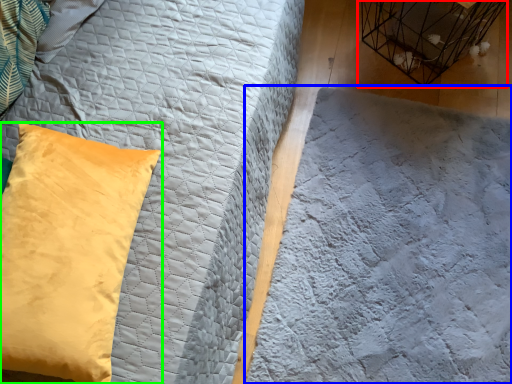
Question: Based on their relative distances, which object is nearer to bird cage (highlighted by a red box)? Choose from sheet (highlighted by a blue box) and pillow (highlighted by a green box).

Choices:
 (A) sheet
 (B) pillow

Answer: (A)